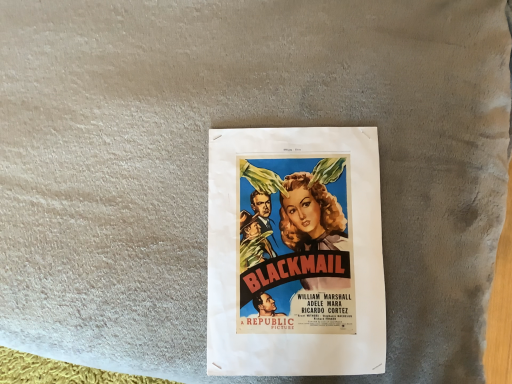
The width and height of the screenshot is (512, 384). What do you see at coordinates (295, 252) in the screenshot?
I see `matte paper poster at center` at bounding box center [295, 252].

In order to face matte paper poster at center, should I rotate leftwards or rightwards?

To align with it, rotate right about 5.192°.

Locate an element on the screen. matte paper poster at center is located at coordinates (295, 252).

This screenshot has width=512, height=384. Identify the location of matte paper poster at center. (295, 252).